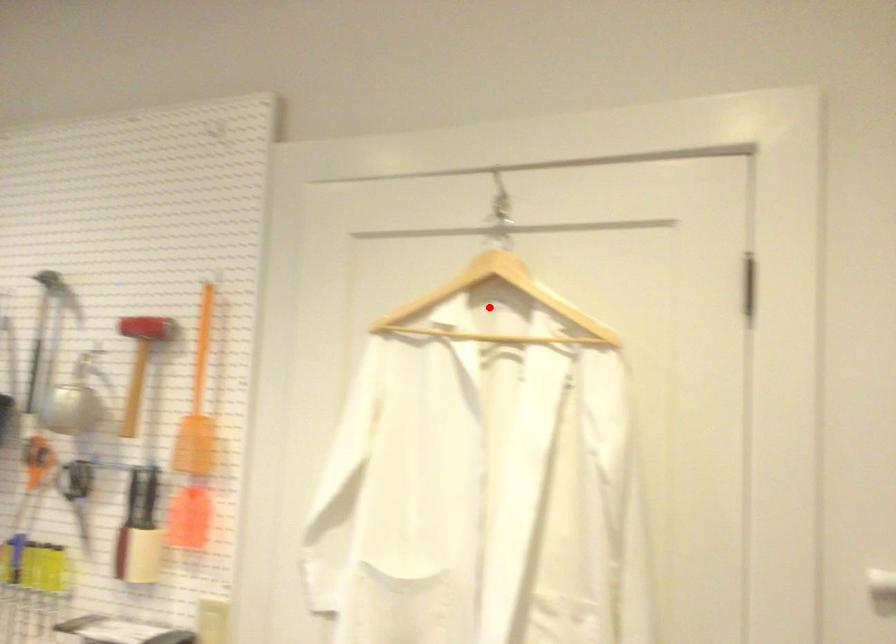
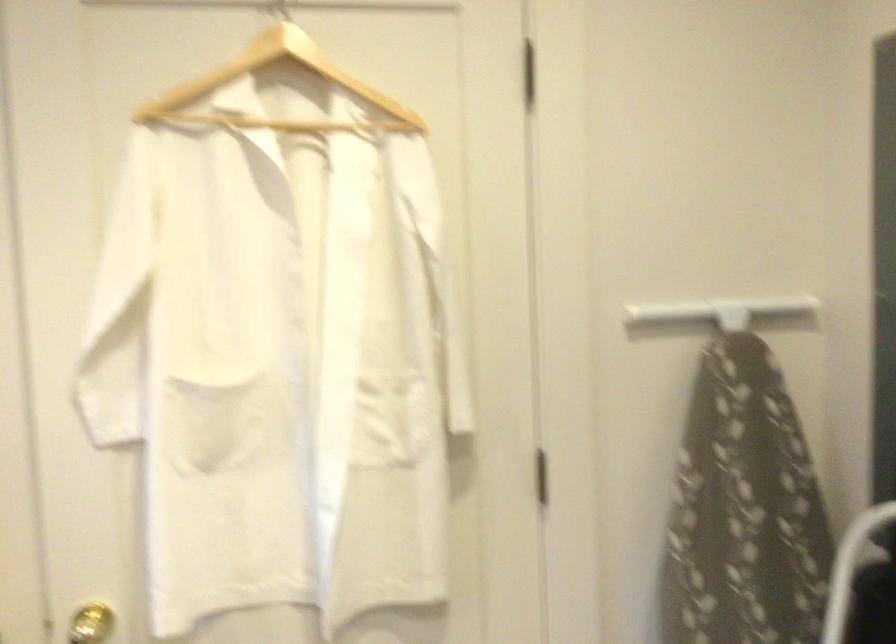
Question: I am providing you with two images of the same scene from different viewpoints. Image1 has a red point marked. In image2, the corresponding 3D location appears at what relative position? Reply with the corresponding letter.

Choices:
 (A) Closer
 (B) Farther

Answer: (A)